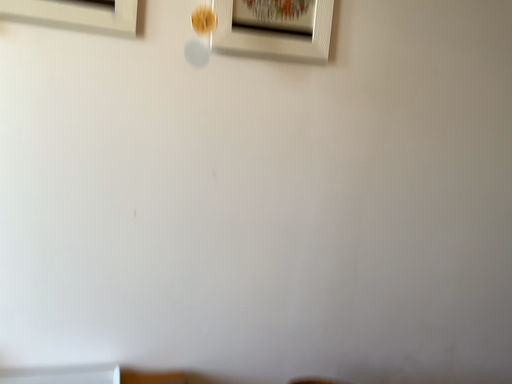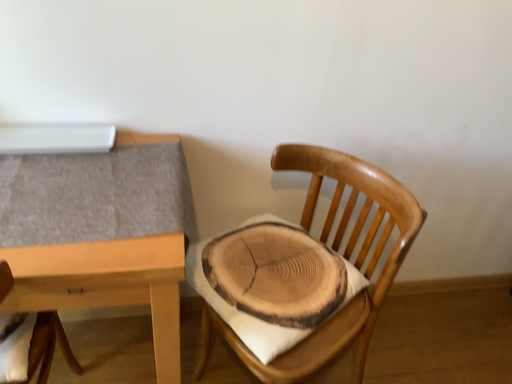
Question: How did the camera likely rotate when shooting the video?

Choices:
 (A) rotated upward
 (B) rotated downward

Answer: (B)